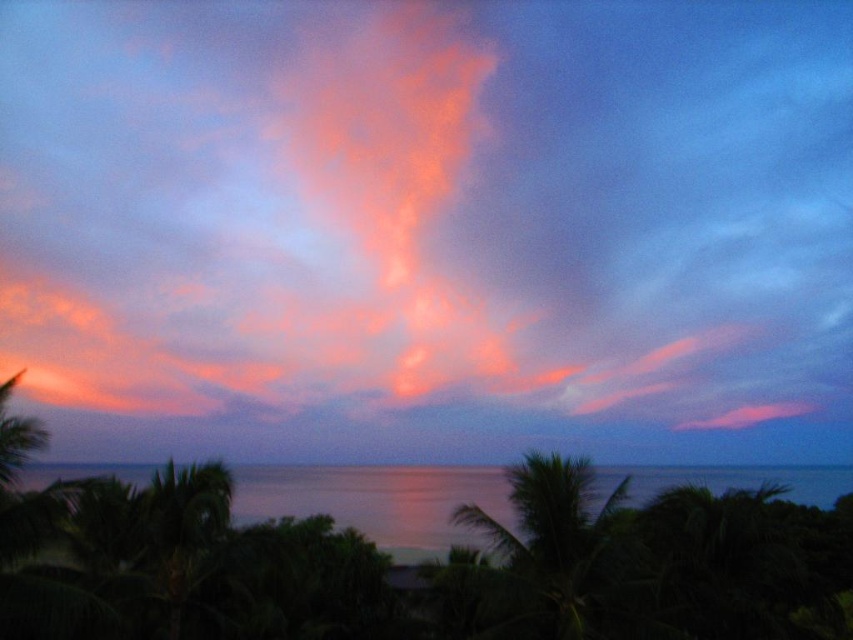
Which is behind, point (221, 342) or point (544, 637)?

Positioned behind is point (221, 342).

Locate an element on the screen. Image resolution: width=853 pixels, height=640 pixels. vivid orange cloud at center is located at coordinates (428, 227).

What do you see at coordinates (428, 227) in the screenshot? The width and height of the screenshot is (853, 640). I see `vivid orange cloud at center` at bounding box center [428, 227].

Find the location of a particular element. vivid orange cloud at center is located at coordinates (428, 227).

Is glossy water at center in front of green leafy palm tree at center?

No, glossy water at center is behind green leafy palm tree at center.

Between glossy water at center and green leafy palm tree at center, which one is positioned higher?

green leafy palm tree at center is above.

Is point (49, 467) behind point (556, 477)?

Yes, point (49, 467) is behind point (556, 477).

Locate an element on the screen. The image size is (853, 640). glossy water at center is located at coordinates (376, 500).

Measure the distance between vivid orange cloud at center and glossy water at center.

vivid orange cloud at center and glossy water at center are 28.08 meters apart.

Identify the location of vivid orange cloud at center. The image size is (853, 640). (428, 227).